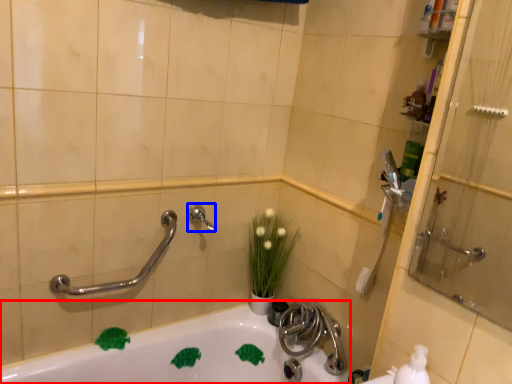
Question: Among these objects, which one is nearest to the camera, bathtub (highlighted by a red box) or plumbing fixture (highlighted by a blue box)?

Choices:
 (A) bathtub
 (B) plumbing fixture

Answer: (A)